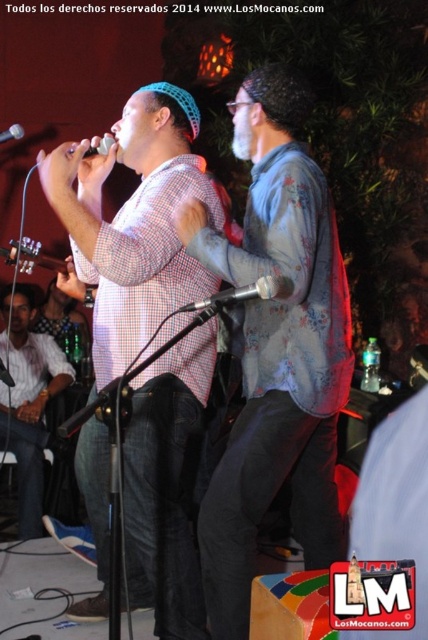
Does point (39, 394) lie in front of point (20, 128)?

No, (39, 394) is behind (20, 128).

The height and width of the screenshot is (640, 428). Identify the location of white shirt at left. (27, 401).

Is floral-patterned shirt at center bigger than black metallic microphone at center?

Correct, floral-patterned shirt at center is larger in size than black metallic microphone at center.

At what (x,y) coordinates should I click in order to perform the action: click on floral-patterned shirt at center. Please return your answer as a coordinate pair (x, y). The width and height of the screenshot is (428, 640). Looking at the image, I should click on (276, 349).

Is point (228, 492) positioned after point (278, 294)?

Yes, it is.

Image resolution: width=428 pixels, height=640 pixels. I want to click on floral-patterned shirt at center, so click(276, 349).

Does floral-patterned shirt at center appear over matte brown guitar at left?

No.

Which is in front, point (228, 602) or point (53, 266)?

Positioned in front is point (228, 602).

Is point (341, 392) positioned before point (56, 266)?

Yes, it is.

Image resolution: width=428 pixels, height=640 pixels. In order to click on floral-patterned shirt at center in this screenshot , I will do `click(276, 349)`.